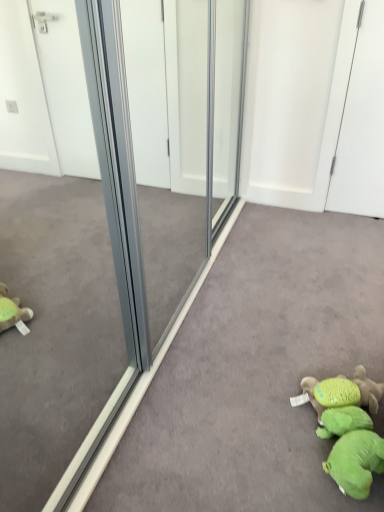
Question: Is green plush toy at lower right, the second toy positioned from the front, inside the boundaries of white glossy screen door at upper right, or outside?

Choices:
 (A) outside
 (B) inside

Answer: (A)

Question: Is green plush toy at lower right, which is counted as the 1th toy, starting from the back, in front of or behind white glossy screen door at upper right in the image?

Choices:
 (A) front
 (B) behind

Answer: (A)

Question: Which object is positioned farthest from the clear glass door at center?

Choices:
 (A) green plush toy at lower right, the 2th toy viewed from the back
 (B) green plush toy at lower right, the second toy positioned from the front
 (C) white glossy screen door at upper right

Answer: (C)

Question: Which is farther from the clear glass door at center?

Choices:
 (A) green plush toy at lower right, the second toy positioned from the front
 (B) green plush toy at lower right, the 2th toy viewed from the back
 (C) white glossy screen door at upper right

Answer: (C)